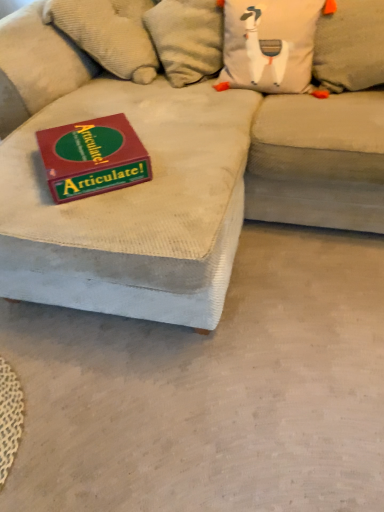
Question: In terms of height, does matte red box at upper left look taller or shorter compared to white fabric pillow at upper center, the second pillow in the right-to-left sequence?

Choices:
 (A) short
 (B) tall

Answer: (A)

Question: In terms of width, does matte red box at upper left look wider or thinner when compared to white fabric pillow at upper center, the second pillow in the right-to-left sequence?

Choices:
 (A) wide
 (B) thin

Answer: (B)

Question: Considering the real-world distances, which object is closest to the gray fabric pillow at upper right, the first pillow when ordered from right to left?

Choices:
 (A) matte red box at upper left
 (B) beige corduroy couch at center
 (C) white fabric pillow at upper center, the second pillow in the right-to-left sequence

Answer: (C)

Question: Which object is positioned farthest from the gray fabric pillow at upper right, the 2th pillow in the left-to-right sequence?

Choices:
 (A) beige corduroy couch at center
 (B) matte red box at upper left
 (C) white fabric pillow at upper center, which is counted as the 1th pillow, starting from the left

Answer: (B)